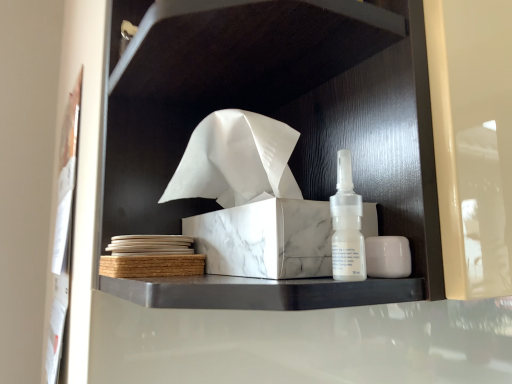
Question: Should I look upward or downward to see white marble tissue box at center?

Choices:
 (A) down
 (B) up

Answer: (B)